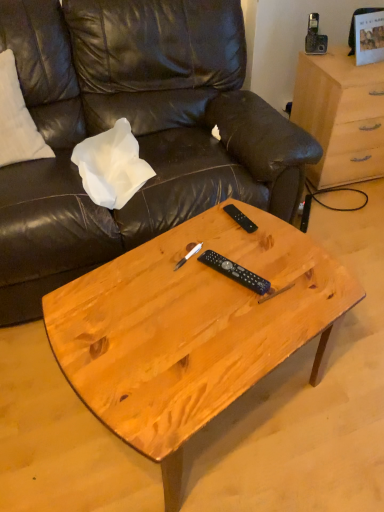
Locate an element on the screen. free space above natural wood coffee table at center (from a real-world perspective) is located at coordinates (201, 301).